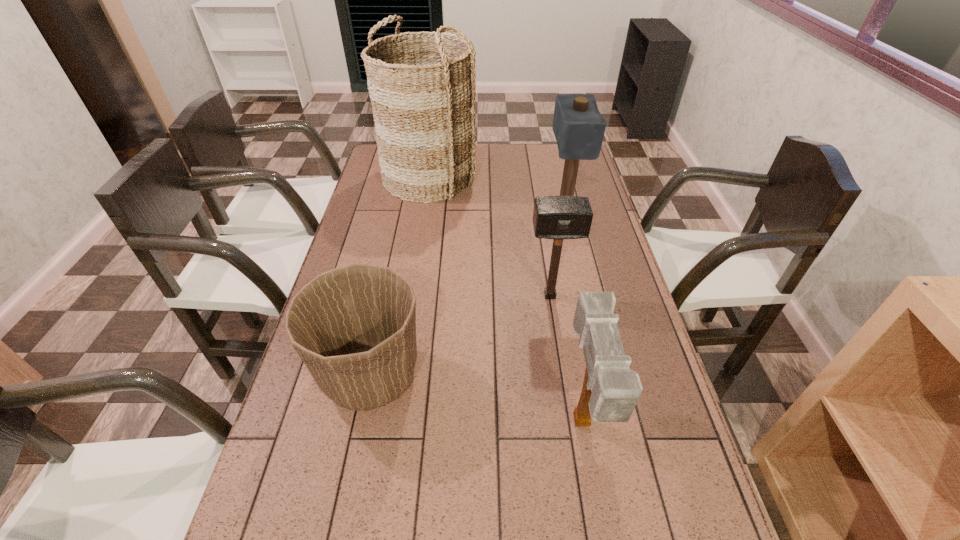
In order to click on free area in between the third farthest object and the shortest object in this screenshot , I will do `click(461, 335)`.

You are a GUI agent. You are given a task and a screenshot of the screen. Output one action in this format:
    pyautogui.click(x=<x>, y=<y>)
    Task: Click on the vacant space that is in between the tallest mallet and the basket
    The height and width of the screenshot is (540, 960).
    Given the screenshot: What is the action you would take?
    pyautogui.click(x=497, y=191)

Where is `vacant area that lies between the shortest object and the second tallest object`? vacant area that lies between the shortest object and the second tallest object is located at coordinates (468, 291).

I want to click on vacant space that's between the second farthest mallet and the nearest mallet, so click(x=565, y=360).

You are a GUI agent. You are given a task and a screenshot of the screen. Output one action in this format:
    pyautogui.click(x=<x>, y=<y>)
    Task: Click on the free space that is in between the tallest mallet and the flowerpot
    The width and height of the screenshot is (960, 540).
    Given the screenshot: What is the action you would take?
    pyautogui.click(x=468, y=291)

Locate an element on the screen. Image resolution: width=960 pixels, height=540 pixels. vacant region between the second farthest mallet and the flowerpot is located at coordinates (461, 335).

Locate an element on the screen. This screenshot has height=540, width=960. free space between the tallest object and the second tallest object is located at coordinates (497, 191).

The image size is (960, 540). In order to click on the closest object to the tallest object in this screenshot , I will do `click(578, 126)`.

Identify which object is the fourth nearest to the farthest mallet. Please provide its 2D coordinates. Your answer should be formatted as a tuple, i.e. [(x, y)], where the tuple contains the x and y coordinates of a point satisfying the conditions above.

[(610, 392)]

Locate which mallet ranks second in proximity to the tallest object. Please provide its 2D coordinates. Your answer should be formatted as a tuple, i.e. [(x, y)], where the tuple contains the x and y coordinates of a point satisfying the conditions above.

[(554, 217)]